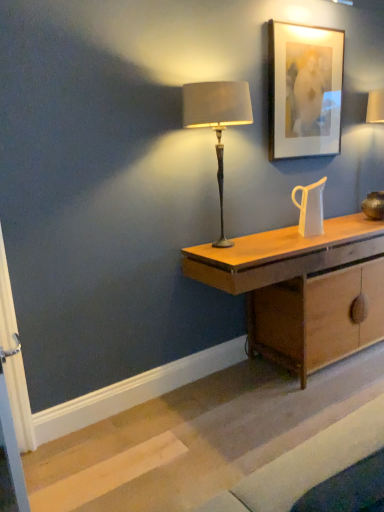
This screenshot has height=512, width=384. Identify the location of free area below matte beige fabric lampshade at center (from a real-world perspective). (225, 245).